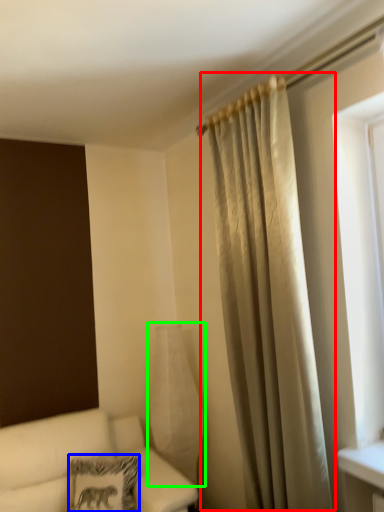
Question: Based on their relative distances, which object is farther from curtain (highlighted by a red box)? Choose from pillow (highlighted by a blue box) and glass vase (highlighted by a green box).

Choices:
 (A) pillow
 (B) glass vase

Answer: (A)